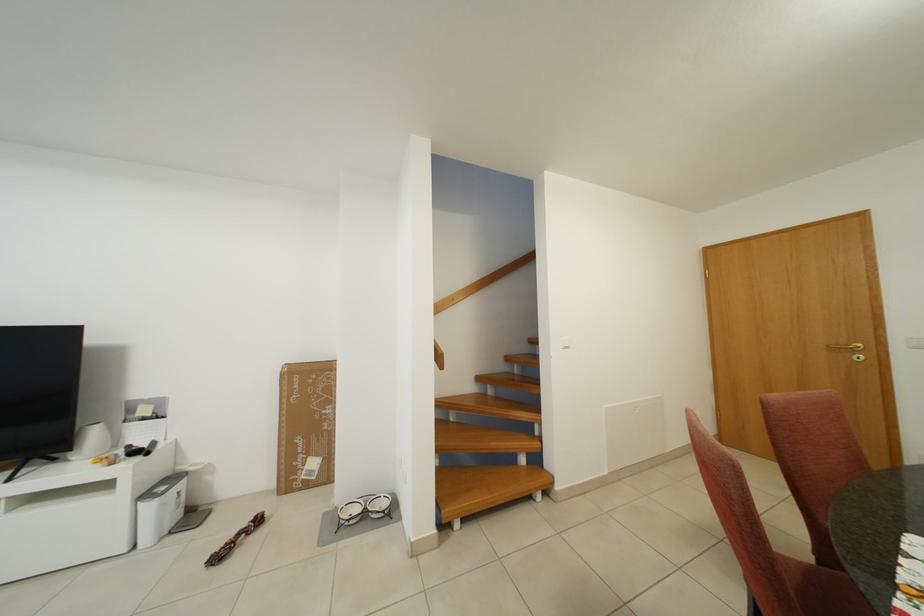
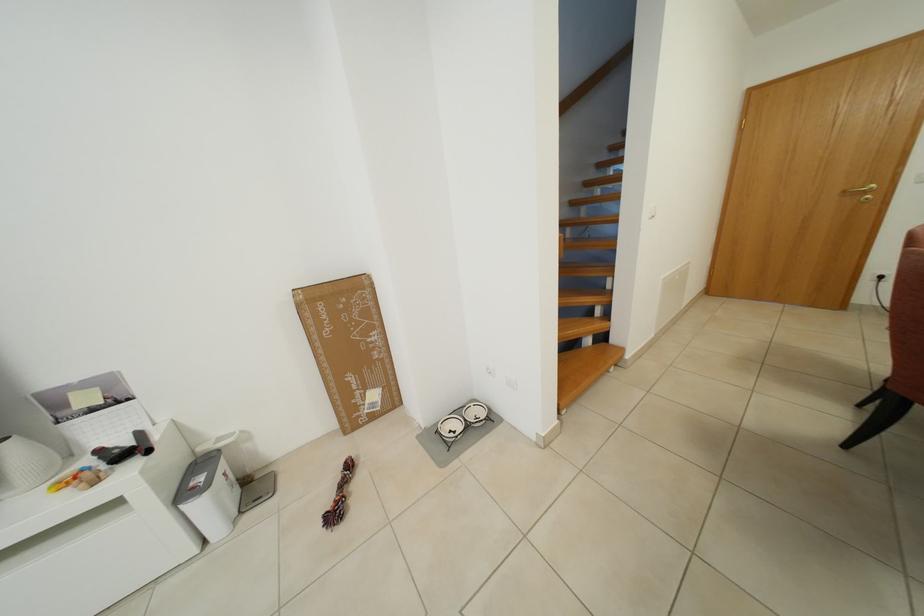
In the second image, find the point that corresponds to (252,528) in the first image.

(346, 479)